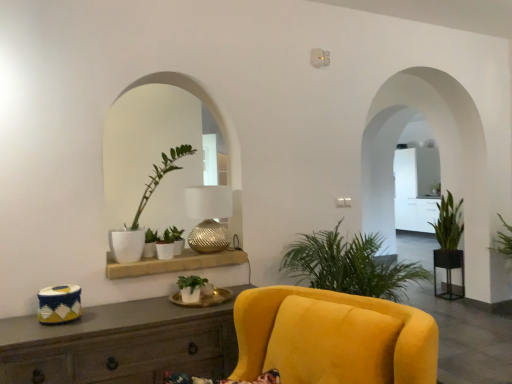
Question: Is green leafy plant at right, positioned as the 1th houseplant in right-to-left order, in front of white ceramic round table at center, which ranks as the second round table in right-to-left order?

Choices:
 (A) no
 (B) yes

Answer: (A)

Question: Is green leafy plant at right, acting as the fifth houseplant starting from the front, not inside white ceramic round table at center, the 1th round table when ordered from front to back?

Choices:
 (A) no
 (B) yes

Answer: (B)

Question: Does green leafy plant at right, positioned as the 1th houseplant in right-to-left order, have a lesser height compared to white ceramic round table at center, which ranks as the 2th round table in back-to-front order?

Choices:
 (A) yes
 (B) no

Answer: (B)

Question: Is green leafy plant at right, the sixth houseplant viewed from the left, far from white ceramic round table at center, acting as the first round table starting from the left?

Choices:
 (A) no
 (B) yes

Answer: (B)

Question: Considering the relative positions of green leafy plant at right, positioned as the 1th houseplant in right-to-left order, and white ceramic round table at center, marked as the 2th round table in a bottom-to-top arrangement, in the image provided, is green leafy plant at right, positioned as the 1th houseplant in right-to-left order, to the left of white ceramic round table at center, marked as the 2th round table in a bottom-to-top arrangement, from the viewer's perspective?

Choices:
 (A) no
 (B) yes

Answer: (A)

Question: From the image's perspective, is green matte plant at center, which is the third houseplant in back-to-front order, located above or below metallic round table at right, which is the first round table in back-to-front order?

Choices:
 (A) above
 (B) below

Answer: (A)

Question: Do you think green matte plant at center, the sixth houseplant when ordered from right to left, is within metallic round table at right, which is counted as the 2th round table, starting from the left, or outside of it?

Choices:
 (A) inside
 (B) outside

Answer: (B)

Question: Looking at their shapes, would you say green matte plant at center, positioned as the fourth houseplant in front-to-back order, is wider or thinner than metallic round table at right, which is counted as the 2th round table, starting from the left?

Choices:
 (A) thin
 (B) wide

Answer: (A)

Question: From a real-world perspective, is green matte plant at center, positioned as the fourth houseplant in front-to-back order, above or below metallic round table at right, the 2th round table in the front-to-back sequence?

Choices:
 (A) above
 (B) below

Answer: (A)

Question: From a real-world perspective, is green matte plant at center, which ranks as the third houseplant in left-to-right order, above or below matte white shelf at center?

Choices:
 (A) below
 (B) above

Answer: (B)

Question: Choose the correct answer: Is green matte plant at center, the 3th houseplant viewed from the front, inside matte white shelf at center or outside it?

Choices:
 (A) outside
 (B) inside

Answer: (A)

Question: In the image, is green matte plant at center, positioned as the 4th houseplant in right-to-left order, positioned in front of or behind matte white shelf at center?

Choices:
 (A) front
 (B) behind

Answer: (B)

Question: Looking at their shapes, would you say green matte plant at center, positioned as the 4th houseplant in right-to-left order, is wider or thinner than matte white shelf at center?

Choices:
 (A) wide
 (B) thin

Answer: (B)

Question: Does point (198, 238) appear closer or farther from the camera than point (202, 306)?

Choices:
 (A) closer
 (B) farther

Answer: (B)

Question: Is metallic textured lamp at center taller or shorter than white ceramic round table at center, the 1th round table when ordered from front to back?

Choices:
 (A) short
 (B) tall

Answer: (B)